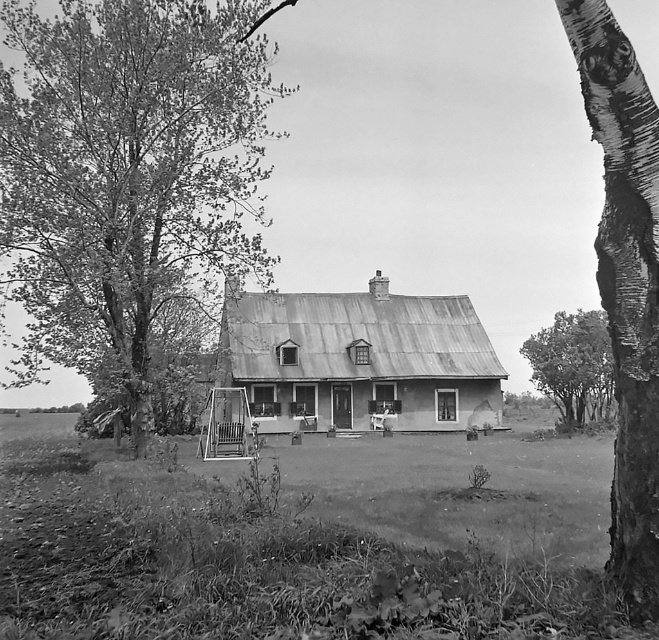
Is smooth bark birch tree at right shorter than smooth bark tree at right?

Indeed, smooth bark birch tree at right has a lesser height compared to smooth bark tree at right.

What do you see at coordinates (625, 284) in the screenshot?
I see `smooth bark birch tree at right` at bounding box center [625, 284].

Where is `smooth bark birch tree at right`? This screenshot has width=659, height=640. smooth bark birch tree at right is located at coordinates (625, 284).

Is smooth bark tree at left in front of smooth bark tree at right?

Yes, it is in front of smooth bark tree at right.

Where is `smooth bark tree at left`? Image resolution: width=659 pixels, height=640 pixels. smooth bark tree at left is located at coordinates (129, 168).

Between smooth bark tree at left and smooth bark birch tree at right, which one is positioned higher?

smooth bark tree at left

The width and height of the screenshot is (659, 640). What do you see at coordinates (129, 168) in the screenshot? I see `smooth bark tree at left` at bounding box center [129, 168].

In order to click on smooth bark tree at left in this screenshot , I will do `click(129, 168)`.